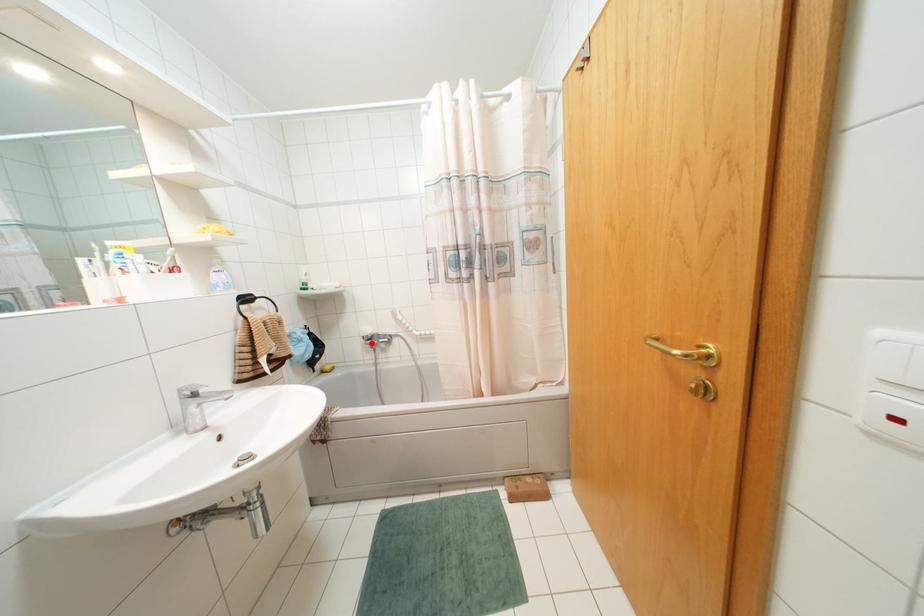
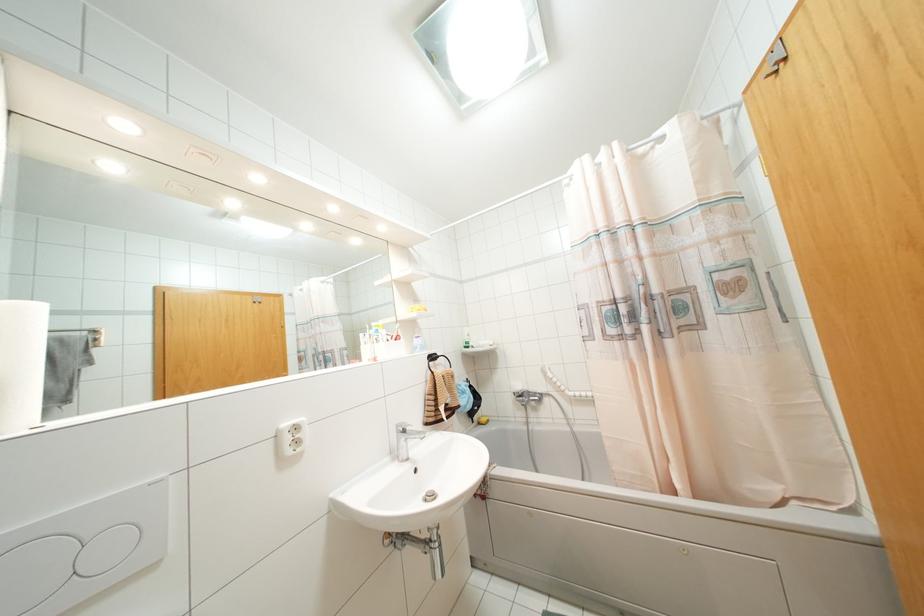
The point at the highlighted location is marked in the first image. Where is the corresponding point in the second image?

(523, 400)